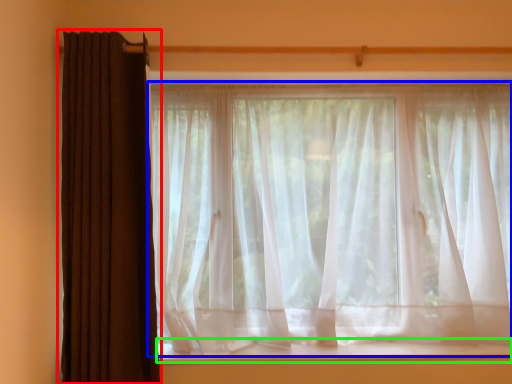
Question: Considering the real-world distances, which object is closest to curtain (highlighted by a red box)? curtain (highlighted by a blue box) or window sill (highlighted by a green box).

Choices:
 (A) curtain
 (B) window sill

Answer: (A)